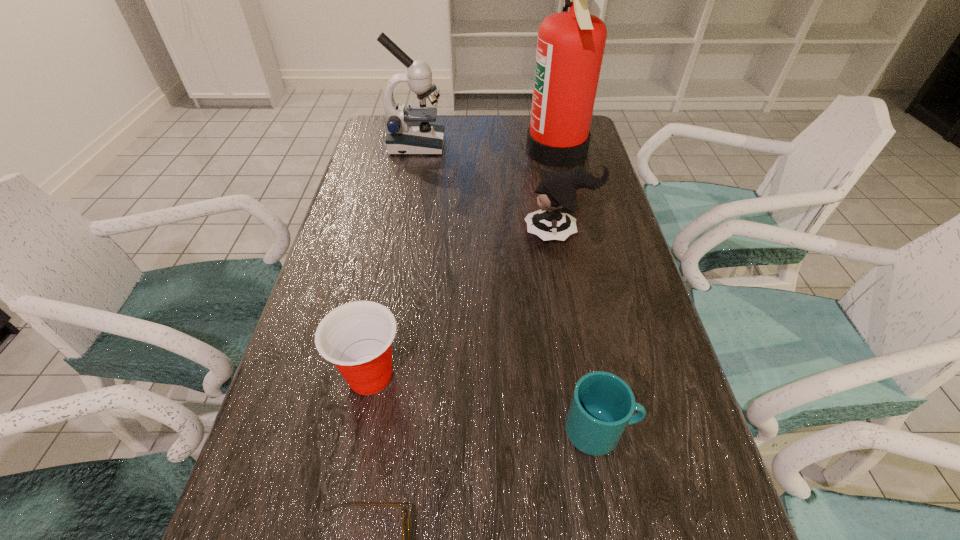
I want to click on the tallest object, so click(570, 45).

Where is `microscope`? The width and height of the screenshot is (960, 540). microscope is located at coordinates (409, 132).

The image size is (960, 540). Find the location of `doll`. doll is located at coordinates (557, 198).

At what (x,y) coordinates should I click in order to perform the action: click on the third tallest object. Please return your answer as a coordinate pair (x, y). The height and width of the screenshot is (540, 960). Looking at the image, I should click on click(x=557, y=198).

At what (x,y) coordinates should I click in order to perform the action: click on the taller cup. Please return your answer as a coordinate pair (x, y). Image resolution: width=960 pixels, height=540 pixels. Looking at the image, I should click on (356, 337).

Where is `the third shortest object`? The image size is (960, 540). the third shortest object is located at coordinates (356, 337).

You are a GUI agent. You are given a task and a screenshot of the screen. Output one action in this format:
    pyautogui.click(x=<x>, y=<y>)
    Task: Click on the second shortest object
    
    Given the screenshot: What is the action you would take?
    pyautogui.click(x=602, y=405)

Image resolution: width=960 pixels, height=540 pixels. I want to click on the right cup, so click(602, 405).

The height and width of the screenshot is (540, 960). I want to click on free space located 0.200m at the nozzle of the fire extinguisher, so click(x=465, y=151).

Locate an element on the screen. This screenshot has height=540, width=960. blank space located at the nozzle of the fire extinguisher is located at coordinates (505, 151).